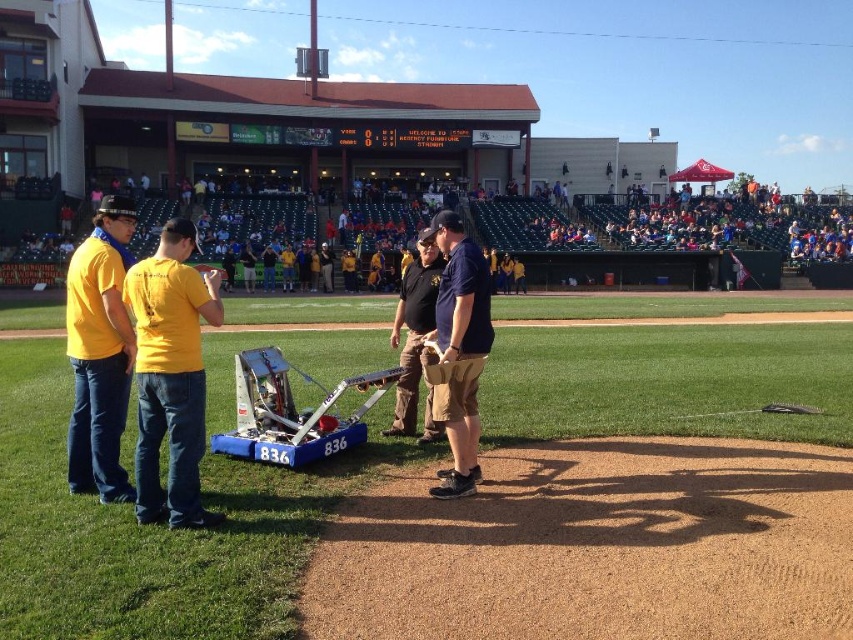
Can you confirm if yellow matte shirt at left is taller than black leather jacket at center?

Yes, yellow matte shirt at left is taller than black leather jacket at center.

Between yellow matte shirt at left and black leather jacket at center, which one is positioned higher?

Positioned higher is black leather jacket at center.

The width and height of the screenshot is (853, 640). I want to click on yellow matte shirt at left, so click(x=171, y=374).

Can you confirm if matte yellow shirt at left is bigger than black leather jacket at center?

Yes, matte yellow shirt at left is bigger than black leather jacket at center.

Where is `matte yellow shirt at left`? The image size is (853, 640). matte yellow shirt at left is located at coordinates (99, 353).

Where is `matte yellow shirt at left`? This screenshot has width=853, height=640. matte yellow shirt at left is located at coordinates (99, 353).

Can you confirm if yellow matte shirt at left is bigger than dark blue uniform at center?

Correct, yellow matte shirt at left is larger in size than dark blue uniform at center.

Is point (155, 298) positioned in front of point (463, 333)?

Yes, it is.

Is point (189, 243) more distant than point (488, 339)?

That is False.

Locate an element on the screen. yellow matte shirt at left is located at coordinates click(x=171, y=374).